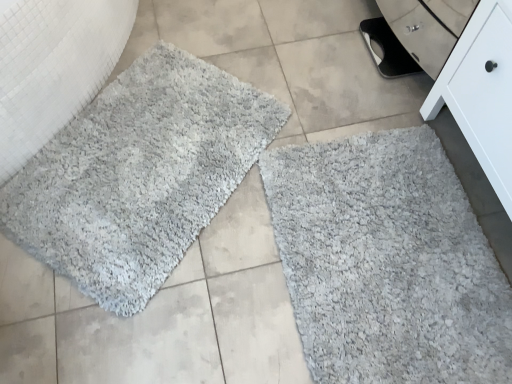
This screenshot has width=512, height=384. I want to click on empty space that is ontop of gray shaggy rug at upper left, acting as the 1th bath mat starting from the left (from a real-world perspective), so click(x=140, y=152).